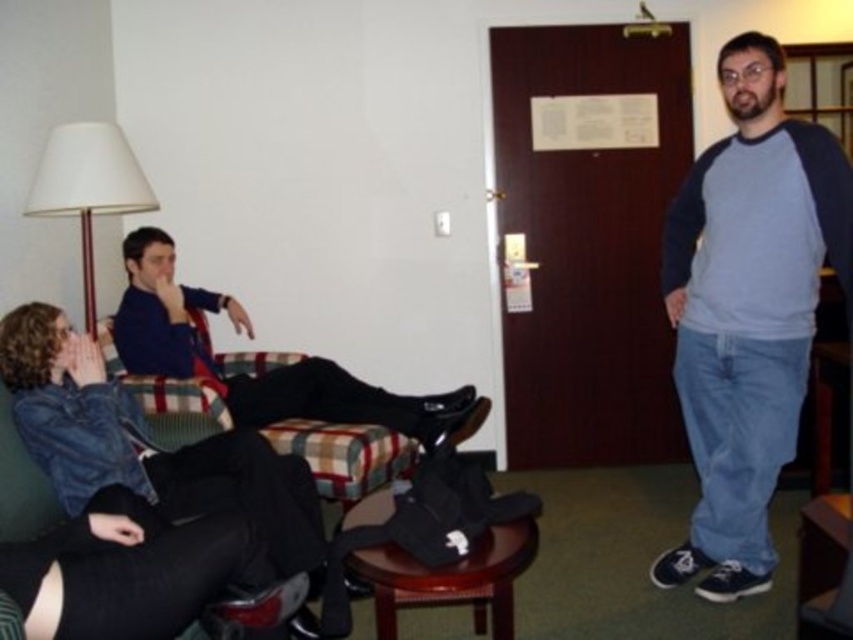
Question: Considering the relative positions of blue cotton shirt at right and brown wooden stool at lower center in the image provided, where is blue cotton shirt at right located with respect to brown wooden stool at lower center?

Choices:
 (A) above
 (B) below

Answer: (A)

Question: Can you confirm if denim jacket at lower left is positioned to the right of blue sweater at center?

Choices:
 (A) no
 (B) yes

Answer: (A)

Question: Which point is farther from the camera taking this photo?

Choices:
 (A) (728, 282)
 (B) (450, 412)

Answer: (B)

Question: Which object appears farthest from the camera in this image?

Choices:
 (A) denim jacket at lower left
 (B) blue cotton shirt at right
 (C) white fabric lampshade at upper left

Answer: (C)

Question: From the image, what is the correct spatial relationship of blue sweater at center in relation to plaid fabric couch at center?

Choices:
 (A) below
 (B) above

Answer: (B)

Question: Which point appears farthest from the camera in this image?

Choices:
 (A) (131, 182)
 (B) (749, 336)
 (C) (286, 512)
 (D) (252, 387)

Answer: (D)